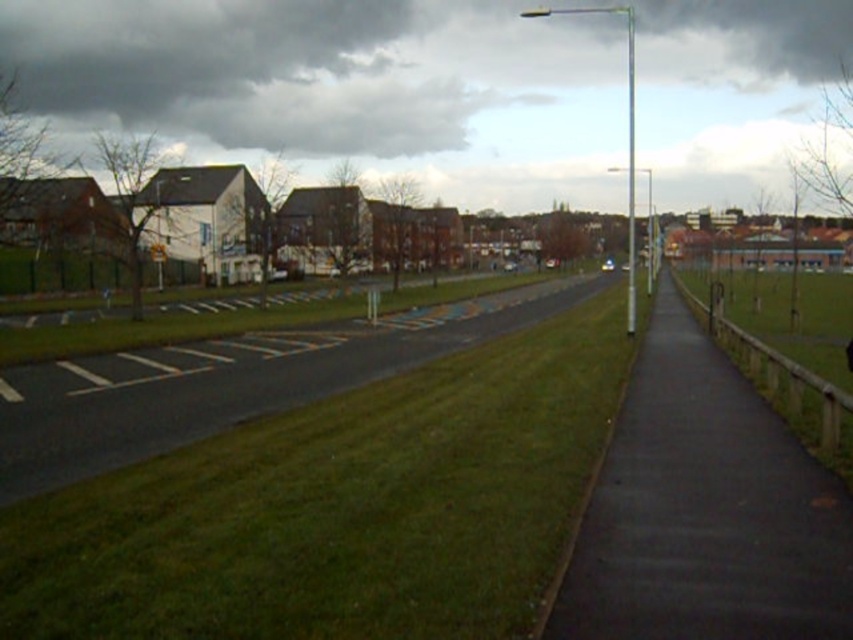
You are a gardener who needs to mow the lawn. You see the green grass at center and the black asphalt sidewalk at right. Which area requires mowing?

The green grass at center requires mowing because it is a grassy area, while the black asphalt sidewalk at right is an asphalt surface and does not need mowing.

You are a gardener planning to water the green grass at center and the black asphalt sidewalk at right. Which area should you water first if you want to start from the closest object to you?

The green grass at center is positioned under the black asphalt sidewalk at right, meaning it is closer to you. Therefore, you should water the green grass at center first.